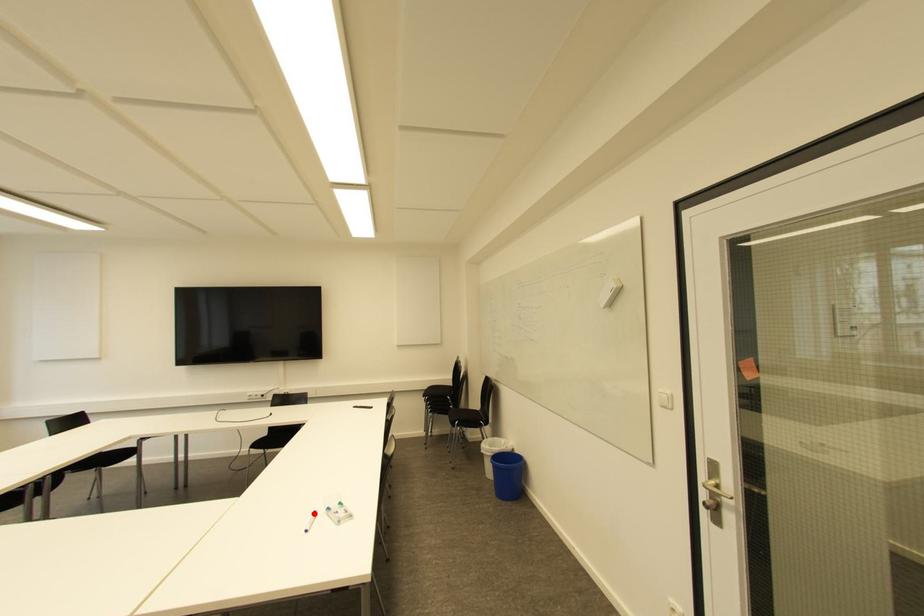
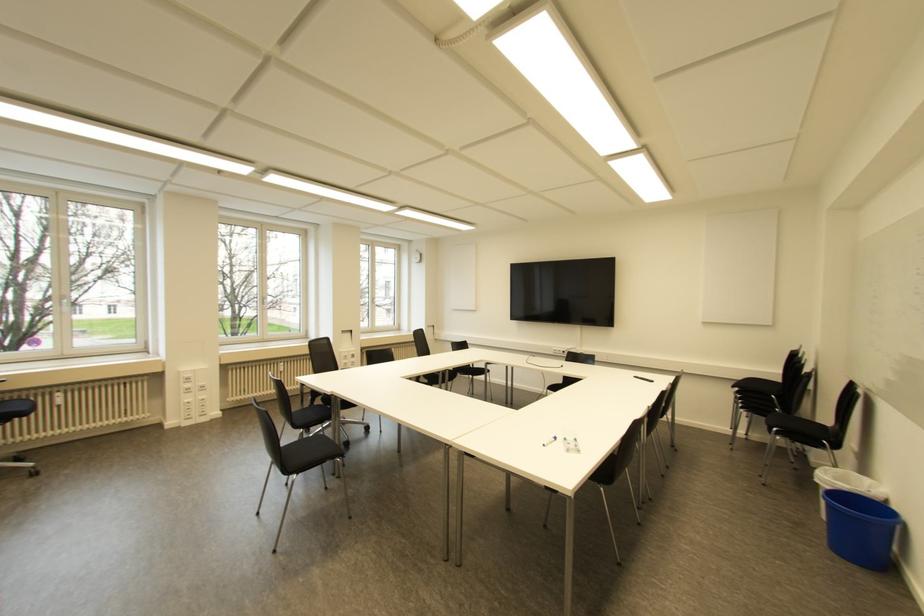
Question: I am providing you with two images of the same scene from different viewpoints. A red point is shown in image1. For the corresponding object point in image2, is it positioned nearer or farther from the camera?

Choices:
 (A) Nearer
 (B) Farther

Answer: (A)